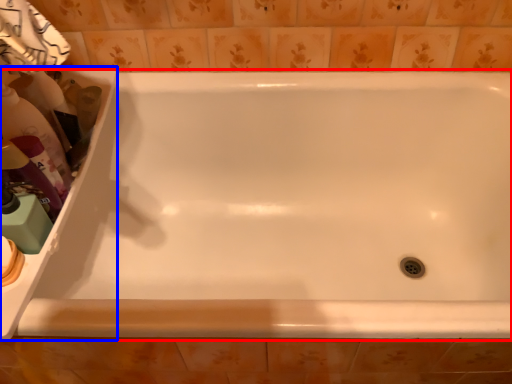
Question: Which object appears closest to the camera in this image, bathtub (highlighted by a red box) or sink (highlighted by a blue box)?

Choices:
 (A) bathtub
 (B) sink

Answer: (A)